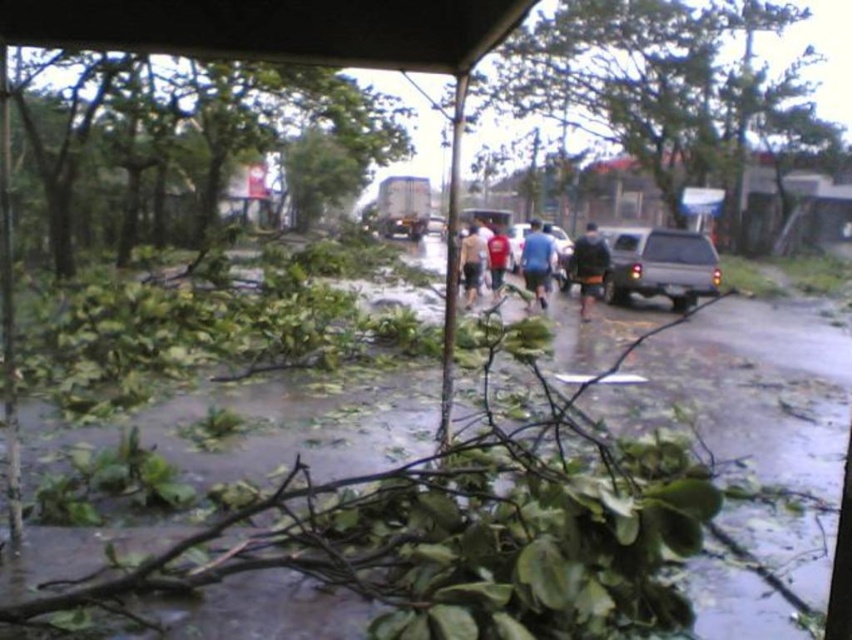
Looking at this image, can you confirm if green leafy debris at center is shorter than matte blue car at center?

Indeed, green leafy debris at center has a lesser height compared to matte blue car at center.

Can you confirm if green leafy debris at center is positioned to the right of matte blue car at center?

No, green leafy debris at center is not to the right of matte blue car at center.

Locate an element on the screen. The height and width of the screenshot is (640, 852). green leafy debris at center is located at coordinates (753, 419).

Find the location of a particular element. The height and width of the screenshot is (640, 852). green leafy debris at center is located at coordinates (753, 419).

Is the position of dark blue jacket at center less distant than that of matte blue car at center?

Yes.

Is dark blue jacket at center further to camera compared to matte blue car at center?

No, it is in front of matte blue car at center.

Is point (591, 278) positioned before point (560, 262)?

Yes, it is.

At what (x,y) coordinates should I click in order to perform the action: click on dark blue jacket at center. Please return your answer as a coordinate pair (x, y). The width and height of the screenshot is (852, 640). Looking at the image, I should click on 589,266.

Is green leafy debris at center wider than dark blue jacket at center?

Correct, the width of green leafy debris at center exceeds that of dark blue jacket at center.

Between green leafy debris at center and dark blue jacket at center, which one appears on the right side from the viewer's perspective?

Positioned to the right is dark blue jacket at center.

Does point (707, 365) lie behind point (596, 298)?

No.

Locate an element on the screen. green leafy debris at center is located at coordinates (753, 419).